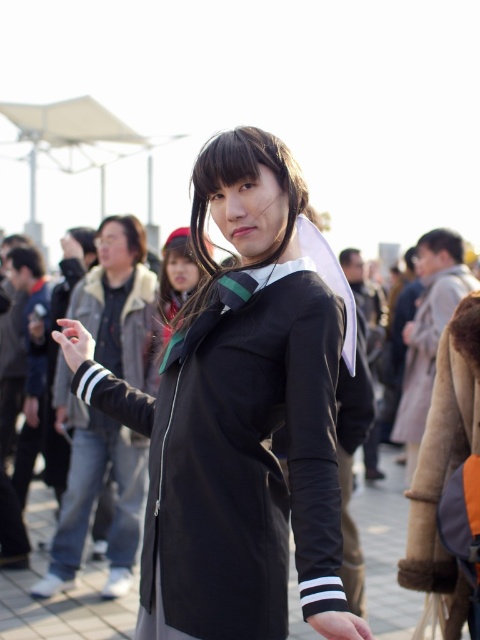
Question: Which object appears farthest from the camera in this image?

Choices:
 (A) beige fur coat at right
 (B) black fabric dress at center
 (C) black matte jacket at center

Answer: (C)

Question: Can you confirm if black fabric dress at center is positioned to the right of beige fur coat at right?

Choices:
 (A) yes
 (B) no

Answer: (B)

Question: Which object appears closest to the camera in this image?

Choices:
 (A) black fabric dress at center
 (B) beige fur coat at right
 (C) black matte jacket at center

Answer: (A)

Question: Based on their relative distances, which object is nearer to the black matte jacket at center?

Choices:
 (A) beige fur coat at right
 (B) black fabric dress at center

Answer: (B)

Question: Is beige fur coat at right positioned behind black matte jacket at center?

Choices:
 (A) no
 (B) yes

Answer: (A)

Question: Can you confirm if beige fur coat at right is bigger than black matte jacket at center?

Choices:
 (A) no
 (B) yes

Answer: (A)